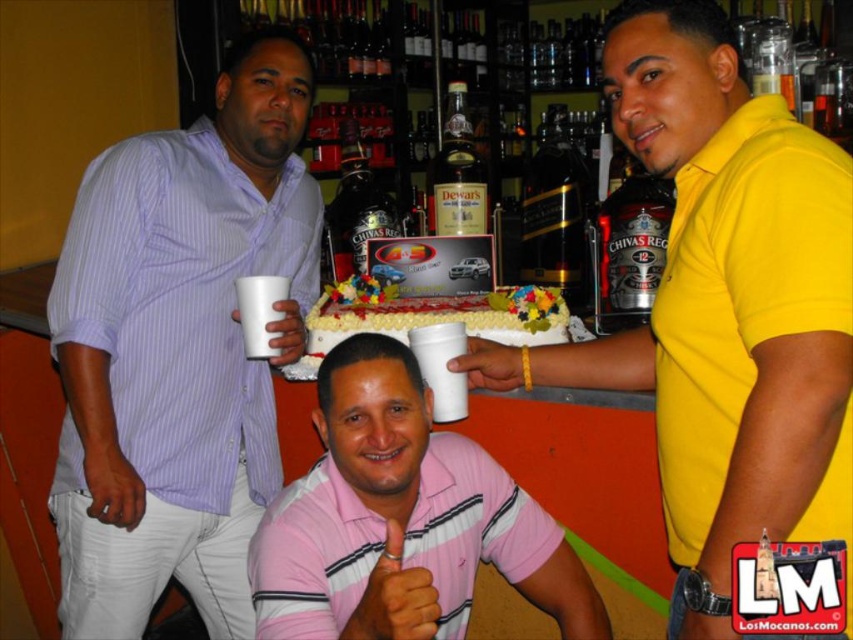
You are at the lively bar gathering and want to place a small decoration between the two points, point (x=772, y=504) and point (x=442, y=224). To ensure it is visible to everyone, which point should you position it closer to?

You should position the decoration closer to point (x=772, y=504) because it is closer to the viewer than point (x=442, y=224), making it more visible to everyone at the gathering.